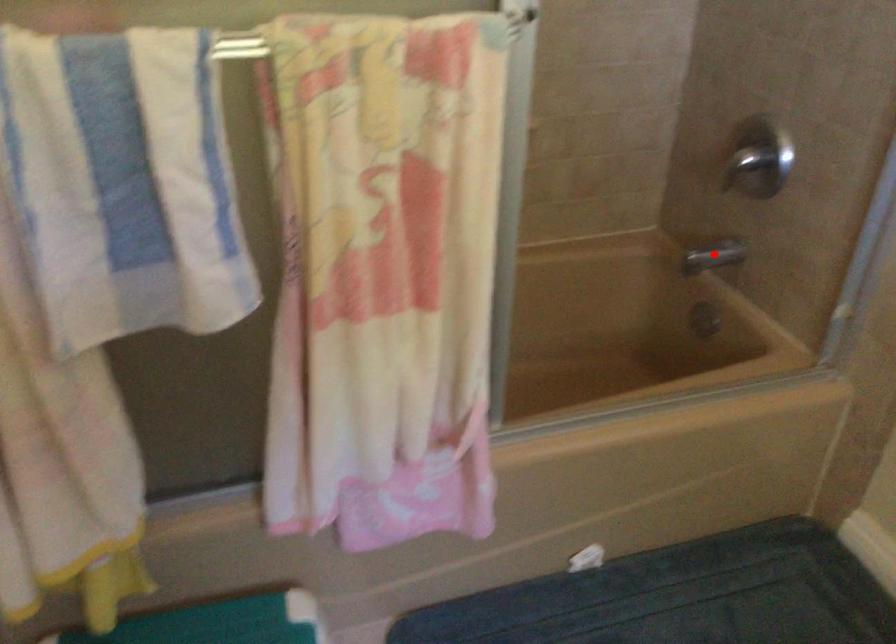
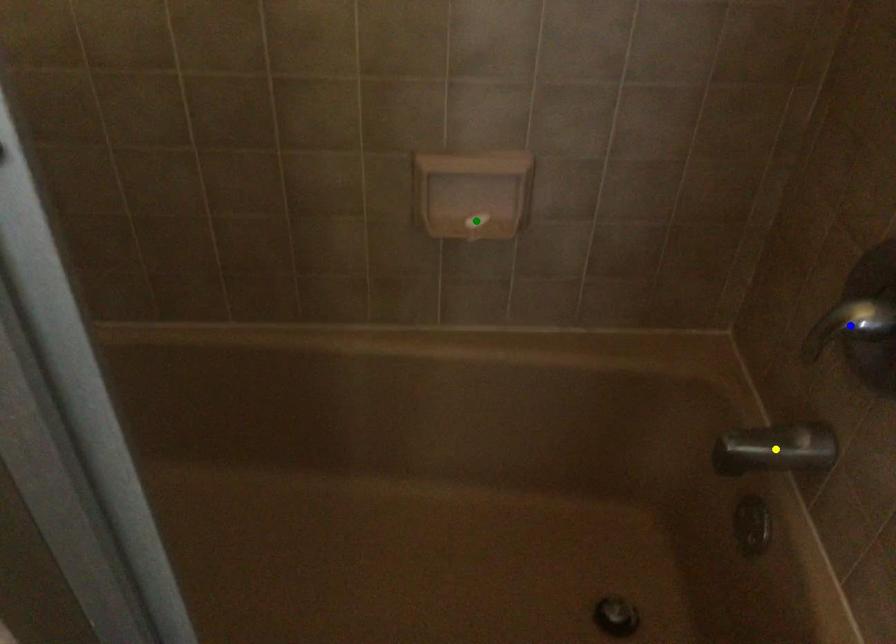
Question: I am providing you with two images of the same scene from different viewpoints. A red point is marked on the first image. You are given multiple points on the second image. Which spot in image 2 lines up with the point in image 1?

Choices:
 (A) yellow point
 (B) green point
 (C) blue point

Answer: (A)